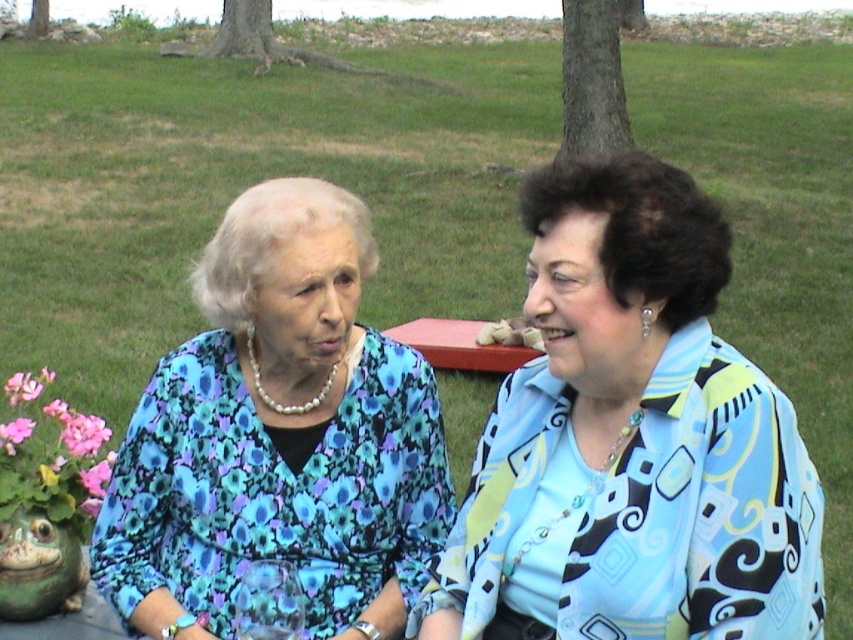
Two women are sitting in a park. The woman on the left is wearing a floral fabric blouse at center. They are 3.31 meters apart. Can a standard 1.5 meter long umbrella cover both of them if placed between them?

The two women are 3.31 meters apart, which is longer than the 1.5 meter umbrella. Therefore, the umbrella cannot cover both of them if placed between them.

Based on the photo, you are a photographer trying to capture a closeup of the light blue printed blouse at right and the pink fabric flower at lower left. Which object should you zoom in on to ensure both fit in the frame without cropping?

Since the light blue printed blouse at right is wider than the pink fabric flower at lower left, you should zoom in on the light blue printed blouse at right to ensure both objects fit within the frame without cropping.

You are a photographer setting up for a portrait in the park. You notice the floral fabric blouse at center and the pink fabric flower at lower left. Which object should you focus on to ensure it appears larger in the final photo?

The floral fabric blouse at center should be focused on because it is much taller than the pink fabric flower at lower left, making it appear larger in the photo.